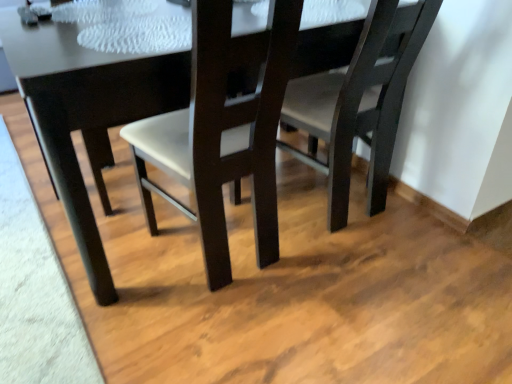
Question: From a real-world perspective, is matte dark wood chair at center, which ranks as the 1th chair in right-to-left order, positioned above or below matte black table at center?

Choices:
 (A) below
 (B) above

Answer: (B)

Question: In the image, is matte dark wood chair at center, which ranks as the 1th chair in right-to-left order, on the left side or the right side of matte black table at center?

Choices:
 (A) right
 (B) left

Answer: (A)

Question: Which object is the closest to the matte dark wood chair at center, which ranks as the first chair in left-to-right order?

Choices:
 (A) matte black table at center
 (B) matte dark wood chair at center, which ranks as the 1th chair in right-to-left order

Answer: (A)

Question: Which object is the closest to the matte black table at center?

Choices:
 (A) matte dark wood chair at center, which ranks as the first chair in left-to-right order
 (B) matte dark wood chair at center, which is counted as the second chair, starting from the left

Answer: (A)